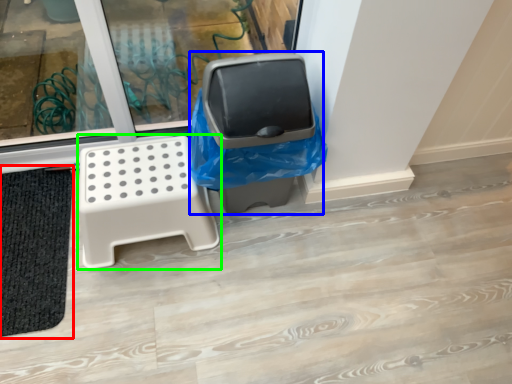
Question: Based on their relative distances, which object is nearer to bath mat (highlighted by a red box)? Choose from garbage (highlighted by a blue box) and furniture (highlighted by a green box).

Choices:
 (A) garbage
 (B) furniture

Answer: (B)